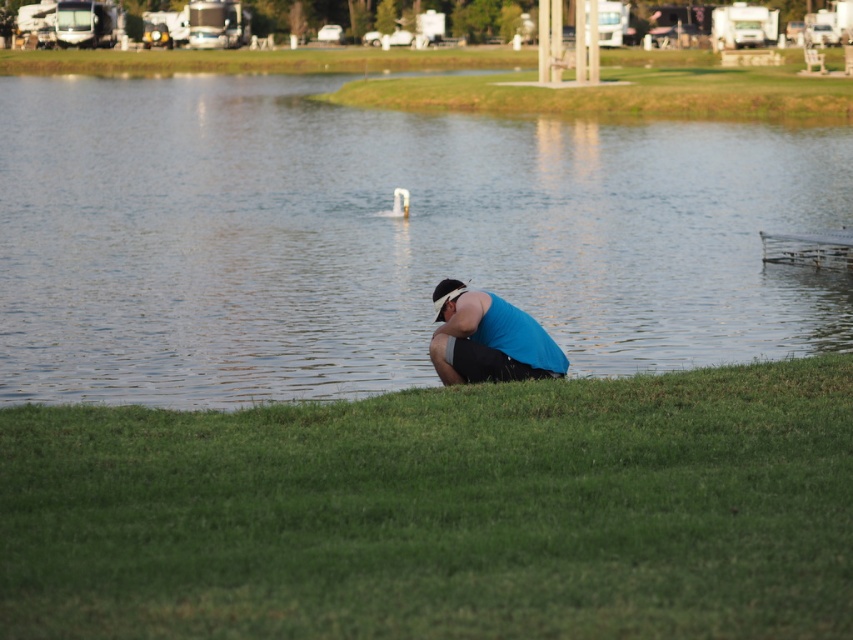
You are standing on the lakeside and want to place a small floating toy in the water. The toy requires a space wider than the blue fabric at center. Can the clear water at center provide enough space for it?

The clear water at center has a width larger than the blue fabric at center, so yes, the clear water at center can provide enough space for the small floating toy.

You are planning to set up a picnic blanket on the lakeside. The green grass at lower center and the blue fabric at center are both in your view. Which area would you choose if you want a larger space for your picnic setup?

The green grass at lower center is bigger than the blue fabric at center, so you should choose the green grass at lower center for a larger space.